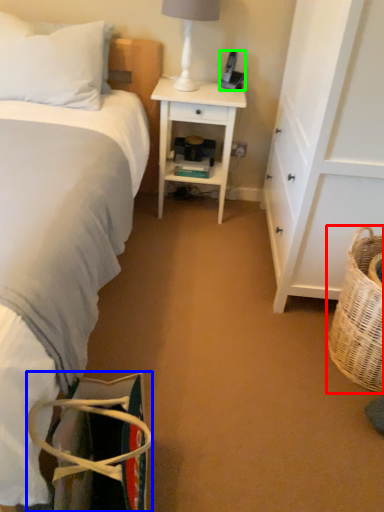
Question: Estimate the real-world distances between objects in this image. Which object is farther from picnic basket (highlighted by a red box), handbag (highlighted by a blue box) or corded phone (highlighted by a green box)?

Choices:
 (A) handbag
 (B) corded phone

Answer: (B)